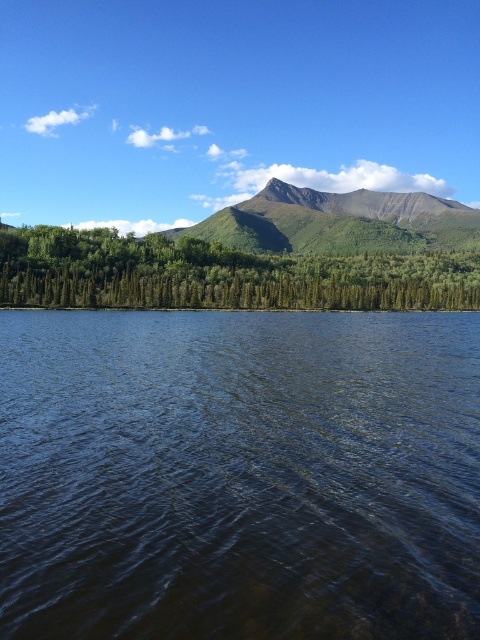
Question: Is green matte trees at center thinner than green textured mountain at center?

Choices:
 (A) no
 (B) yes

Answer: (B)

Question: Estimate the real-world distances between objects in this image. Which object is closer to the green matte trees at center?

Choices:
 (A) green textured mountain at center
 (B) dark blue water at center

Answer: (B)

Question: Is green matte trees at center to the right of green textured mountain at center from the viewer's perspective?

Choices:
 (A) yes
 (B) no

Answer: (B)

Question: In this image, where is dark blue water at center located relative to green textured mountain at center?

Choices:
 (A) above
 (B) below

Answer: (B)

Question: Which of these objects is positioned closest to the green matte trees at center?

Choices:
 (A) green textured mountain at center
 (B) dark blue water at center

Answer: (B)

Question: Which object appears farthest from the camera in this image?

Choices:
 (A) dark blue water at center
 (B) green textured mountain at center
 (C) green matte trees at center

Answer: (B)